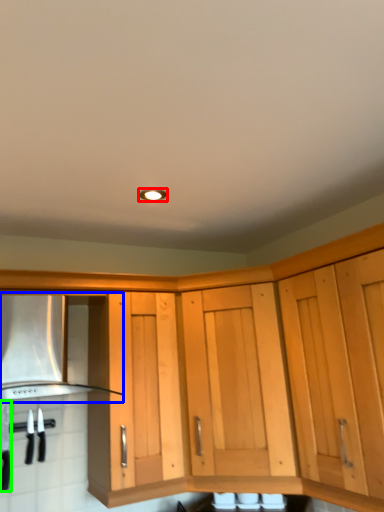
Question: Estimate the real-world distances between objects in this image. Which object is farther from lighting (highlighted by a red box), vent (highlighted by a blue box) or kitchen appliance (highlighted by a green box)?

Choices:
 (A) vent
 (B) kitchen appliance

Answer: (B)